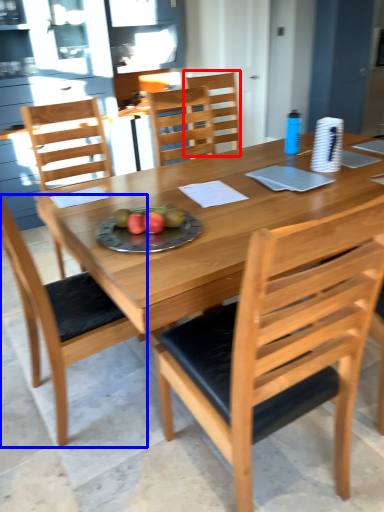
Question: Which object appears closest to the camera in this image, chair (highlighted by a red box) or chair (highlighted by a blue box)?

Choices:
 (A) chair
 (B) chair

Answer: (B)